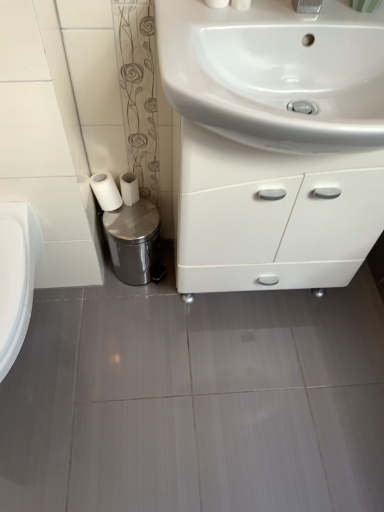
I want to click on white matte toilet paper at lower left, the second toilet paper in the left-to-right sequence, so click(129, 188).

What is the approximate width of white matte toilet paper at lower left, which ranks as the first toilet paper in left-to-right order?

The width of white matte toilet paper at lower left, which ranks as the first toilet paper in left-to-right order, is 3.67 inches.

Find the location of `white glossy sink at upper center`. white glossy sink at upper center is located at coordinates (276, 73).

The width and height of the screenshot is (384, 512). I want to click on white matte toilet paper at lower left, the second toilet paper in the left-to-right sequence, so click(129, 188).

Between white glossy sink at upper center and shiny metallic trash can at lower left, which one has smaller width?

shiny metallic trash can at lower left.

Which is correct: white glossy sink at upper center is inside shiny metallic trash can at lower left, or outside of it?

white glossy sink at upper center is located beyond the bounds of shiny metallic trash can at lower left.

Would you say white glossy sink at upper center is a long distance from shiny metallic trash can at lower left?

No.

Which of these two, white glossy sink at upper center or shiny metallic trash can at lower left, is bigger?

Bigger between the two is white glossy sink at upper center.

From a real-world perspective, is white glossy cabinet at center physically below white glossy sink at upper center?

Indeed, from a real-world perspective, white glossy cabinet at center is positioned beneath white glossy sink at upper center.

In order to click on bathroom cabinet located below the white glossy sink at upper center (from the image's perspective) in this screenshot , I will do `click(270, 214)`.

Is white glossy sink at upper center at the back of white glossy cabinet at center?

That's not correct — white glossy cabinet at center is not looking away from white glossy sink at upper center.

From the image's perspective, which is below, white glossy cabinet at center or white glossy sink at upper center?

white glossy cabinet at center is shown below in the image.

Which is correct: white glossy cabinet at center is inside shiny metallic trash can at lower left, or outside of it?

white glossy cabinet at center exists outside the volume of shiny metallic trash can at lower left.

Does white glossy cabinet at center have a greater width compared to shiny metallic trash can at lower left?

Yes, white glossy cabinet at center is wider than shiny metallic trash can at lower left.

Could you tell me if white glossy cabinet at center is turned towards shiny metallic trash can at lower left?

No, white glossy cabinet at center is not turned towards shiny metallic trash can at lower left.

In terms of height, does shiny metallic trash can at lower left look taller or shorter compared to white matte toilet paper at lower left, the second toilet paper from the right?

shiny metallic trash can at lower left is taller than white matte toilet paper at lower left, the second toilet paper from the right.

Is the depth of shiny metallic trash can at lower left greater than that of white matte toilet paper at lower left, which ranks as the first toilet paper in left-to-right order?

That is True.

Could you tell me if shiny metallic trash can at lower left is facing white matte toilet paper at lower left, the second toilet paper from the right?

A: No, shiny metallic trash can at lower left is not aimed at white matte toilet paper at lower left, the second toilet paper from the right.

Would you say white glossy sink at upper center is a long distance from white matte toilet paper at lower left, the second toilet paper from the right?

That's not correct — white glossy sink at upper center is a little close to white matte toilet paper at lower left, the second toilet paper from the right.

Which object is closer to the camera, white glossy sink at upper center or white matte toilet paper at lower left, which ranks as the first toilet paper in left-to-right order?

Positioned in front is white glossy sink at upper center.

Is white glossy sink at upper center oriented away from white matte toilet paper at lower left, the second toilet paper from the right?

No, white matte toilet paper at lower left, the second toilet paper from the right, is not at the back of white glossy sink at upper center.

Considering the sizes of objects white glossy sink at upper center and white matte toilet paper at lower left, the second toilet paper from the right, in the image provided, who is bigger, white glossy sink at upper center or white matte toilet paper at lower left, the second toilet paper from the right,?

white glossy sink at upper center.

At what (x,y) coordinates should I click in order to perform the action: click on bathroom cabinet below the white matte toilet paper at lower left, the second toilet paper from the right (from the image's perspective). Please return your answer as a coordinate pair (x, y). Image resolution: width=384 pixels, height=512 pixels. Looking at the image, I should click on pos(270,214).

Does white matte toilet paper at lower left, which ranks as the first toilet paper in left-to-right order, have a lesser height compared to white glossy cabinet at center?

Indeed, white matte toilet paper at lower left, which ranks as the first toilet paper in left-to-right order, has a lesser height compared to white glossy cabinet at center.

Is white matte toilet paper at lower left, which ranks as the first toilet paper in left-to-right order, not near white glossy cabinet at center?

white matte toilet paper at lower left, which ranks as the first toilet paper in left-to-right order, is actually quite close to white glossy cabinet at center.

Can you confirm if white glossy cabinet at center is bigger than white matte toilet paper at lower left, the second toilet paper from the right?

Correct, white glossy cabinet at center is larger in size than white matte toilet paper at lower left, the second toilet paper from the right.

From the image's perspective, who appears lower, white glossy cabinet at center or white matte toilet paper at lower left, which ranks as the first toilet paper in left-to-right order?

white glossy cabinet at center, from the image's perspective.

In the image, is white glossy cabinet at center on the left side or the right side of white matte toilet paper at lower left, which ranks as the first toilet paper in left-to-right order?

From the image, it's evident that white glossy cabinet at center is to the right of white matte toilet paper at lower left, which ranks as the first toilet paper in left-to-right order.

At what (x,y) coordinates should I click in order to perform the action: click on the 1st toilet paper behind when counting from the white glossy cabinet at center. Please return your answer as a coordinate pair (x, y). Image resolution: width=384 pixels, height=512 pixels. Looking at the image, I should click on [x=106, y=191].

Image resolution: width=384 pixels, height=512 pixels. I want to click on sink on the right of shiny metallic trash can at lower left, so click(276, 73).

This screenshot has width=384, height=512. There is a white glossy cabinet at center. Identify the location of sink above it (from a real-world perspective). [x=276, y=73].

From the picture: Considering their positions, is white matte toilet paper at lower left, the second toilet paper from the right, positioned further to shiny metallic trash can at lower left than white glossy cabinet at center?

white glossy cabinet at center lies further to shiny metallic trash can at lower left than the other object.

When comparing their distances from white glossy sink at upper center, does white matte toilet paper at lower left, which ranks as the first toilet paper in left-to-right order, or white matte toilet paper at lower left, the second toilet paper in the left-to-right sequence, seem further?

Based on the image, white matte toilet paper at lower left, which ranks as the first toilet paper in left-to-right order, appears to be further to white glossy sink at upper center.

Considering their positions, is white matte toilet paper at lower left, which ranks as the first toilet paper in left-to-right order, positioned closer to white matte toilet paper at lower left, positioned as the first toilet paper in right-to-left order, than shiny metallic trash can at lower left?

Among the two, white matte toilet paper at lower left, which ranks as the first toilet paper in left-to-right order, is located nearer to white matte toilet paper at lower left, positioned as the first toilet paper in right-to-left order.

Looking at the image, which one is located further to white glossy cabinet at center, shiny metallic trash can at lower left or white glossy sink at upper center?

shiny metallic trash can at lower left is positioned further to the anchor white glossy cabinet at center.

Looking at the image, which one is located closer to shiny metallic trash can at lower left, white matte toilet paper at lower left, the second toilet paper in the left-to-right sequence, or white glossy cabinet at center?

white matte toilet paper at lower left, the second toilet paper in the left-to-right sequence, is positioned closer to the anchor shiny metallic trash can at lower left.

Estimate the real-world distances between objects in this image. Which object is closer to white glossy sink at upper center, shiny metallic trash can at lower left or white glossy cabinet at center?

white glossy cabinet at center lies closer to white glossy sink at upper center than the other object.

Which object lies further to the anchor point shiny metallic trash can at lower left, white matte toilet paper at lower left, positioned as the first toilet paper in right-to-left order, or white glossy sink at upper center?

The object further to shiny metallic trash can at lower left is white glossy sink at upper center.

When comparing their distances from white matte toilet paper at lower left, the second toilet paper from the right, does shiny metallic trash can at lower left or white glossy cabinet at center seem closer?

shiny metallic trash can at lower left.

Find the location of a particular element. toilet paper located between white glossy sink at upper center and shiny metallic trash can at lower left in the depth direction is located at coordinates (106, 191).

Identify the location of toilet paper between white glossy cabinet at center and shiny metallic trash can at lower left in the front-back direction. (106, 191).

The height and width of the screenshot is (512, 384). In order to click on bathroom cabinet between white glossy sink at upper center and white matte toilet paper at lower left, positioned as the first toilet paper in right-to-left order, in the front-back direction in this screenshot , I will do `click(270, 214)`.

Identify the location of bathroom cabinet between white glossy sink at upper center and shiny metallic trash can at lower left along the z-axis. (270, 214).